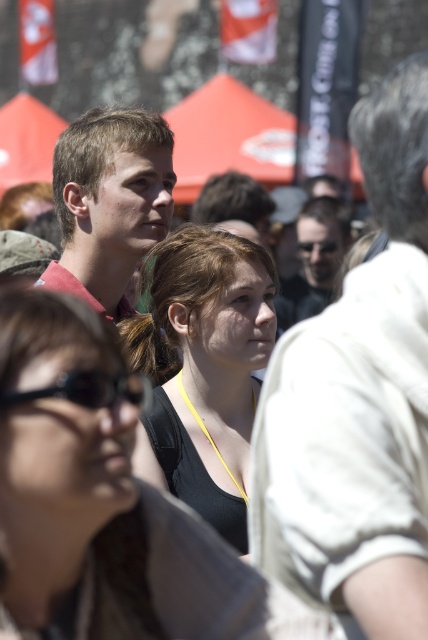
Based on the photo, you are a photographer trying to capture the main subject in the image. The main subject is the young woman in the foreground wearing a black tank top and yellow lanyard. You notice a point at coordinates point [89,388] which marks an object that might be distracting. What object is located at that point and where is it positioned relative to the main subject?

The point [89,388] marks black rubber goggles at lower left, which are positioned to the lower left of the main subject.

You are a photographer trying to capture a clear shot of both the black fabric tank top at center and the matte red shirt at center. Since you want both subjects to be in focus, you need to adjust your camera settings. Which subject should you focus on to ensure both are sharp?

You should focus on the matte red shirt at center because it is farther away from the viewer than the black fabric tank top at center. By focusing on the farther subject, the near subject will also be in focus due to the depth of field.